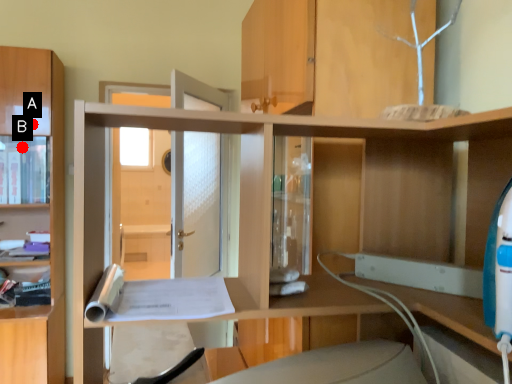
Question: Two points are circled on the image, labeled by A and B beside each circle. Which point is further to the camera?

Choices:
 (A) A is further
 (B) B is further

Answer: (B)